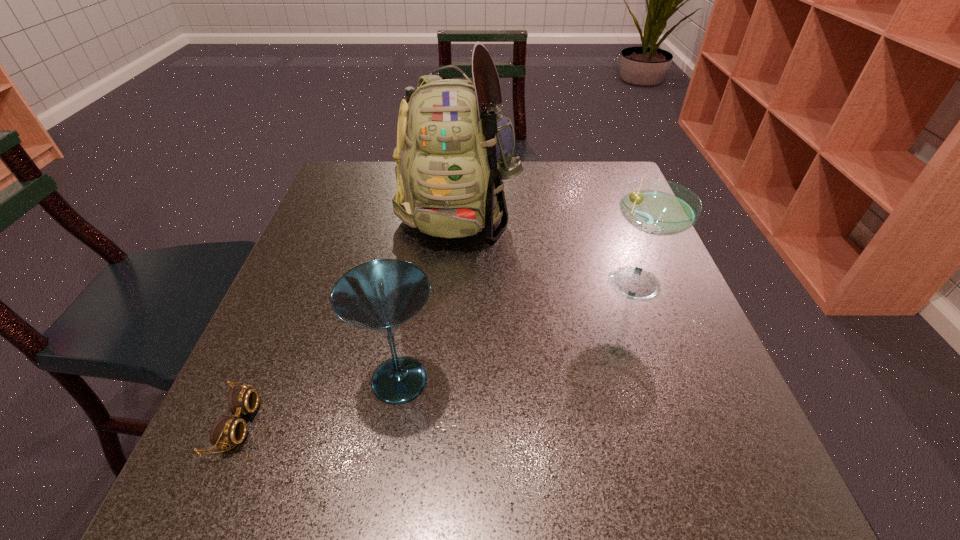
Locate an element on the screen. This screenshot has width=960, height=540. blank region between the nearer martini and the leftmost object is located at coordinates (318, 402).

Locate an element on the screen. The height and width of the screenshot is (540, 960). vacant area that lies between the goggles and the farther martini is located at coordinates (435, 351).

This screenshot has width=960, height=540. I want to click on empty space that is in between the shortest object and the right martini, so click(435, 351).

This screenshot has width=960, height=540. I want to click on empty location between the shortest object and the nearer martini, so click(x=318, y=402).

Find the location of a particular element. free space that is in between the right martini and the left martini is located at coordinates (516, 329).

Identify the location of free spot between the goggles and the nearer martini. This screenshot has height=540, width=960. (318, 402).

The image size is (960, 540). What are the coordinates of `free space between the backpack and the rightmost object` in the screenshot? It's located at (545, 245).

The width and height of the screenshot is (960, 540). What are the coordinates of `object that is the third nearest to the goggles` in the screenshot? It's located at (656, 207).

Locate an element on the screen. The width and height of the screenshot is (960, 540). object that is the second nearest to the leftmost object is located at coordinates (454, 150).

Where is `vacant space that satisfies the following two spatial constraints: 1. on the front-facing side of the backpack; 2. through the lenses of the goggles`? Image resolution: width=960 pixels, height=540 pixels. vacant space that satisfies the following two spatial constraints: 1. on the front-facing side of the backpack; 2. through the lenses of the goggles is located at coordinates (444, 424).